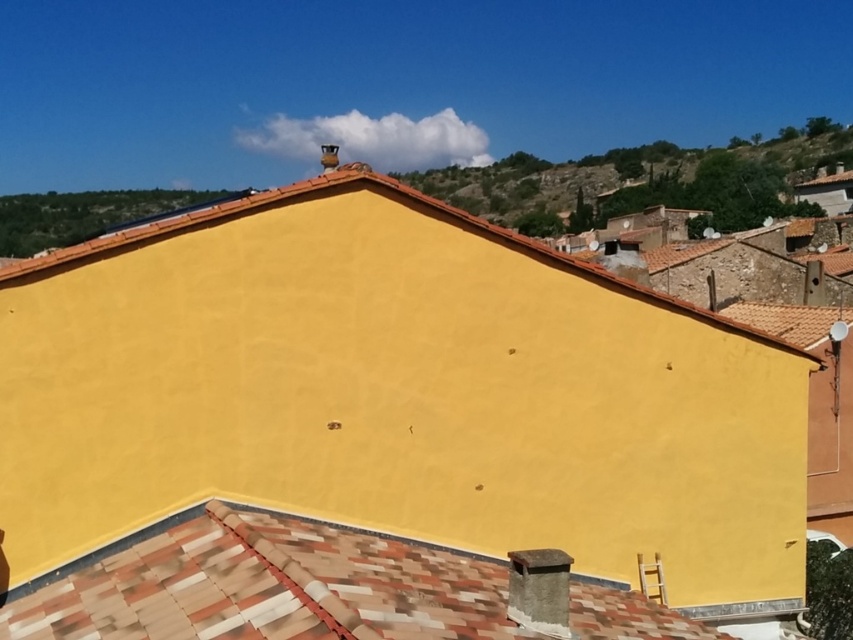
Can you confirm if matte yellow wall at center is bigger than matte yellow wall at upper center?

No.

Locate an element on the screen. matte yellow wall at center is located at coordinates (399, 396).

This screenshot has height=640, width=853. I want to click on matte yellow wall at center, so click(x=399, y=396).

Between point (114, 618) and point (173, 230), which one is positioned behind?

The point (173, 230) is more distant.

Does point (577, 582) lie behind point (585, 269)?

Yes.

Identify the location of terracotta tiles at center. [270, 588].

The width and height of the screenshot is (853, 640). What are the coordinates of `terracotta tiles at center` in the screenshot? It's located at (270, 588).

Can you confirm if matte yellow wall at center is smaller than terracotta tiles at center?

No.

Is the position of matte yellow wall at center more distant than that of terracotta tiles at center?

That is True.

Between point (42, 529) and point (376, 586), which one is positioned behind?

Positioned behind is point (42, 529).

Find the location of a particular element. matte yellow wall at center is located at coordinates (399, 396).